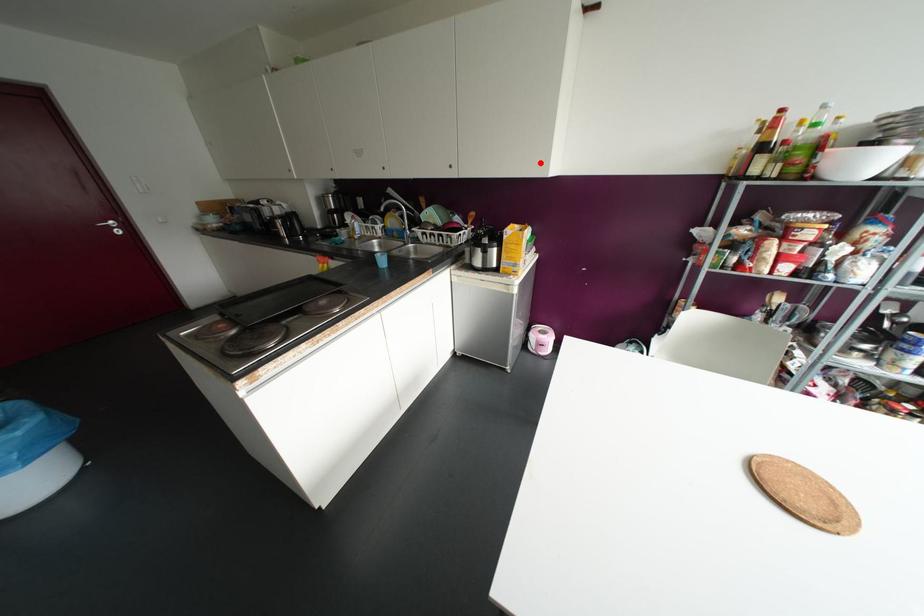
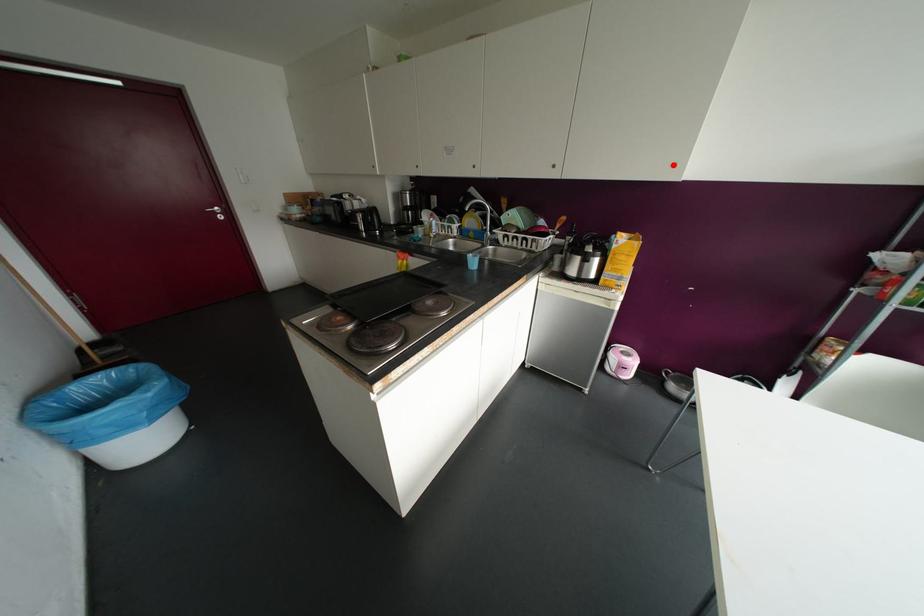
I am providing you with two images of the same scene from different viewpoints. A red point is marked on the first image and another point is marked on the second image. Are the points marked in image1 and image2 representing the same 3D position?

Yes